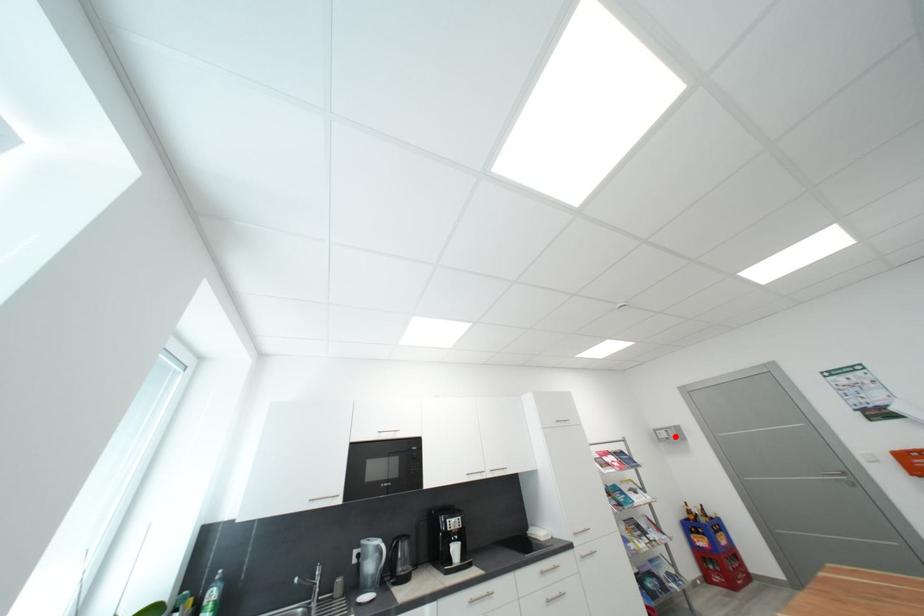
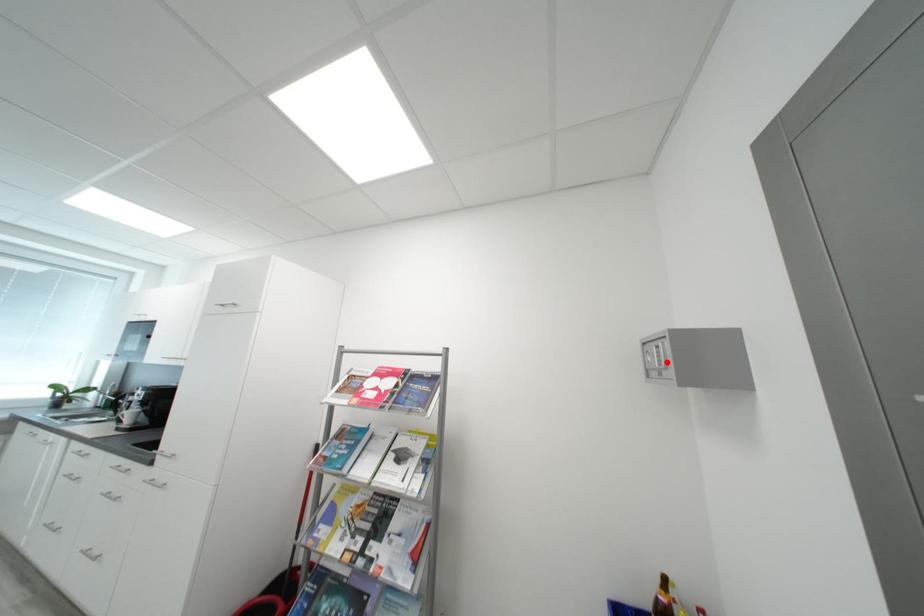
I am providing you with two images of the same scene from different viewpoints. A red point is marked on the first image and another point is marked on the second image. Does the point marked in image1 correspond to the same location as the one in image2?

Yes